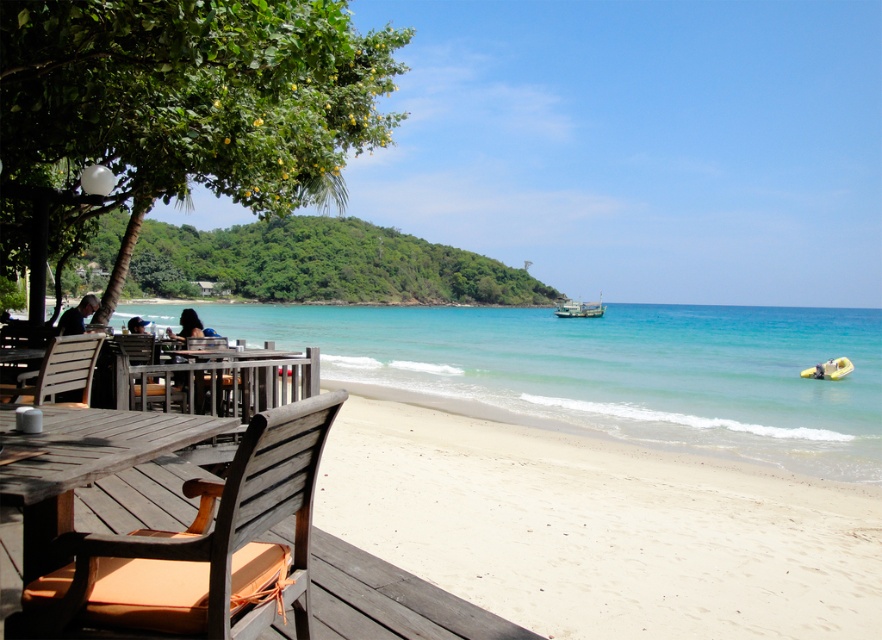
You are planning to place a rectangular table that is 2 meters wide between the clear blue water at center and the wooden textured chair at lower left. Based on their widths, will the table fit between them?

The clear blue water at center is wider than the wooden textured chair at lower left, so the 2 meter wide table may fit if the space between them is sufficient. However, the exact placement depends on the actual distance between the two objects, which isn not specified in the description.

You are standing on the wooden deck and want to walk directly to the white sandy beach at lower center. According to the coordinates provided, in which direction should you move relative to your current position?

The white sandy beach at lower center is located at coordinates point (602,529). Since the coordinate system typically places the origin at the bottom left corner, moving towards the right and slightly upwards would lead you directly to the white sandy beach at lower center.

Based on the photo, you are standing on the wooden deck and want to place a small potted plant between the white sandy beach at lower center and the wooden chair at lower left. Considering their heights, which object should the plant be placed closer to?

The white sandy beach at lower center has a greater height compared to the wooden chair at lower left. Therefore, the plant should be placed closer to the wooden chair at lower left to maintain balance in height.